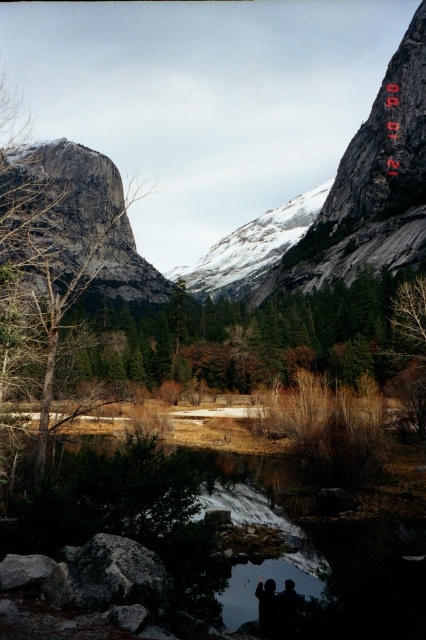
Is gray granite mountain at center bigger than transparent glass puddle at lower center?

Indeed, gray granite mountain at center has a larger size compared to transparent glass puddle at lower center.

Locate an element on the screen. gray granite mountain at center is located at coordinates (89, 220).

Is the position of gray granite mountain at center less distant than that of dark gray jacket at lower center?

That is False.

Is point (103, 188) behind point (275, 611)?

Yes, point (103, 188) is farther from viewer.

Identify the location of gray granite mountain at center. (89, 220).

Who is more forward, (x=143, y=145) or (x=279, y=582)?

Point (x=279, y=582) is in front.

The width and height of the screenshot is (426, 640). What do you see at coordinates (203, 99) in the screenshot?
I see `gray rock mountain at center` at bounding box center [203, 99].

Locate an element on the screen. The image size is (426, 640). gray rock mountain at center is located at coordinates (203, 99).